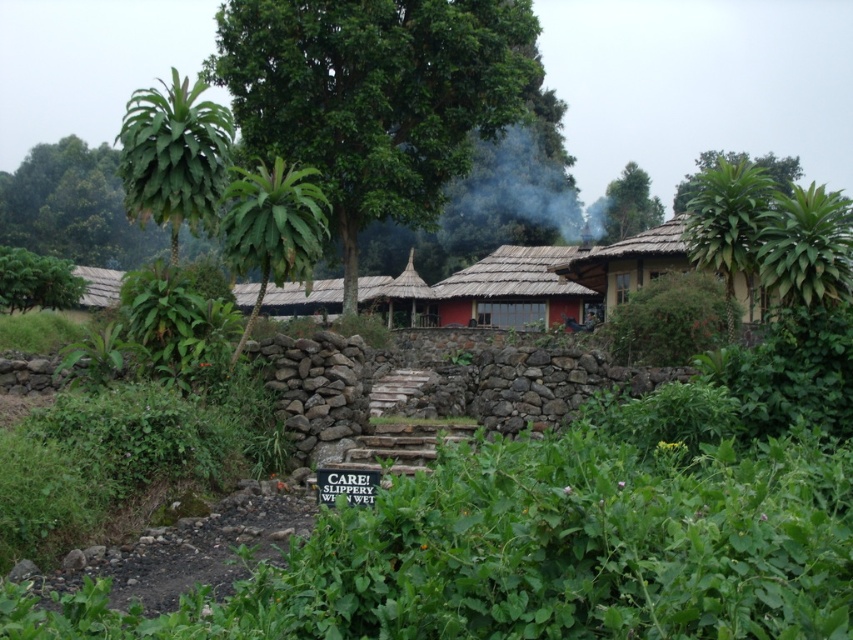
You are standing at the origin point of the image. There is a thatched roof hut at center represented by point (x=303, y=298). Which direction should you move to reach the thatched roof hut at center?

The thatched roof hut at center is located at point (x=303, y=298), so you should move towards the center of the image to reach it.

You are standing at the point marked as point (x=374, y=96) in the image. What is the nearest object to you in the scene?

The nearest object to you is the green leafy tree at center, as the point (x=374, y=96) is located on it.

You are planning to place a bench between the green leafy tree at center and the green leafy tree at upper center. Which tree has a wider trunk to ensure the bench is placed on the wider side?

The green leafy tree at upper center has a wider trunk than the green leafy tree at center, so the bench should be placed on the side of the green leafy tree at upper center.